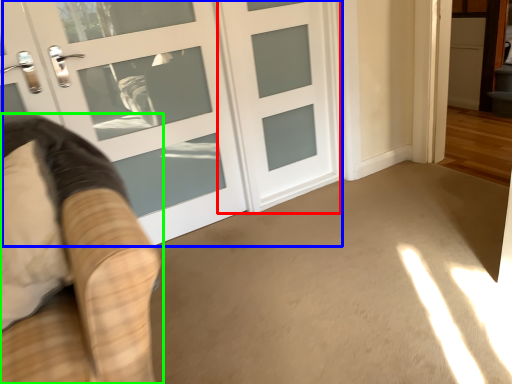
Question: Which object is the closest to the door (highlighted by a red box)? Choose among these: door (highlighted by a blue box) or furniture (highlighted by a green box).

Choices:
 (A) door
 (B) furniture

Answer: (A)